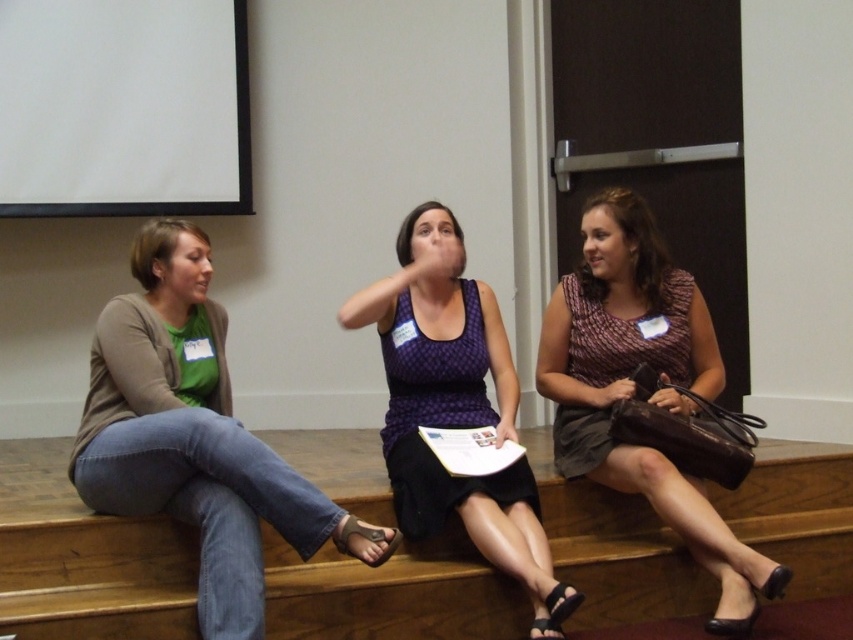
Does matte green shirt at left appear on the left side of purple dotted tank top at center?

Yes, matte green shirt at left is to the left of purple dotted tank top at center.

Can you confirm if matte green shirt at left is wider than purple dotted tank top at center?

Correct, the width of matte green shirt at left exceeds that of purple dotted tank top at center.

I want to click on matte green shirt at left, so click(194, 436).

Measure the distance between white matte projection screen at upper left and matte brown dress at right.

They are 2.38 meters apart.

Does white matte projection screen at upper left have a greater height compared to matte brown dress at right?

No.

Is point (167, 192) closer to viewer compared to point (572, 317)?

No, it is behind (572, 317).

I want to click on white matte projection screen at upper left, so click(123, 108).

Does matte brown dress at right have a smaller size compared to purple dotted tank top at center?

Incorrect, matte brown dress at right is not smaller in size than purple dotted tank top at center.

Where is `matte brown dress at right`? Image resolution: width=853 pixels, height=640 pixels. matte brown dress at right is located at coordinates (636, 387).